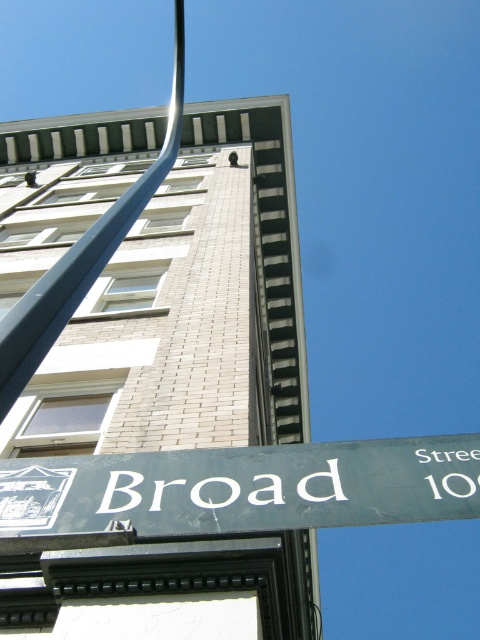
Based on the photo, who is more forward, [178,460] or [93,237]?

Point [93,237] is more forward.

This screenshot has height=640, width=480. What are the coordinates of `green matte street sign at lower center` in the screenshot? It's located at (242, 486).

This screenshot has width=480, height=640. In order to click on green matte street sign at lower center in this screenshot , I will do `click(242, 486)`.